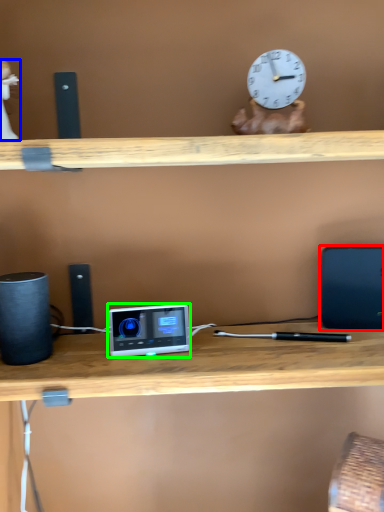
Question: Considering the real-world distances, which object is closest to laptop (highlighted by a red box)? toy (highlighted by a blue box) or ipod (highlighted by a green box).

Choices:
 (A) toy
 (B) ipod

Answer: (B)